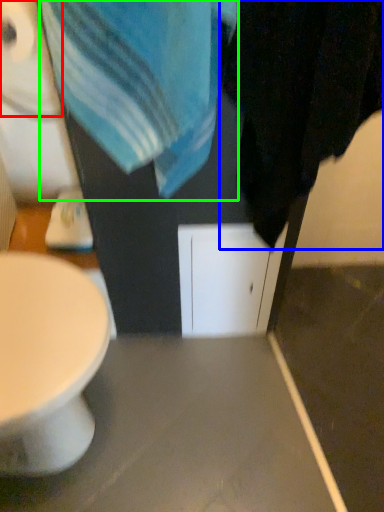
Question: Based on their relative distances, which object is nearer to toilet paper (highlighted by a red box)? Choose from bath towel (highlighted by a blue box) and beach towel (highlighted by a green box).

Choices:
 (A) bath towel
 (B) beach towel

Answer: (B)